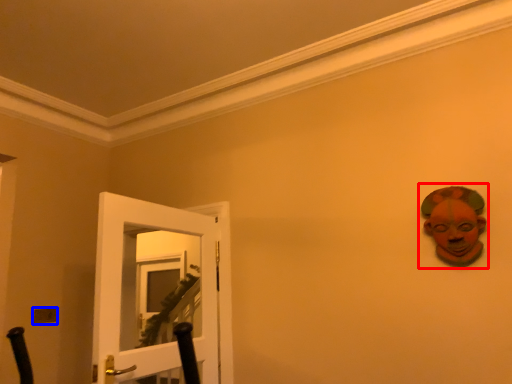
Question: Which object appears closest to the camera in this image, person (highlighted by a red box) or light switch (highlighted by a blue box)?

Choices:
 (A) person
 (B) light switch

Answer: (A)